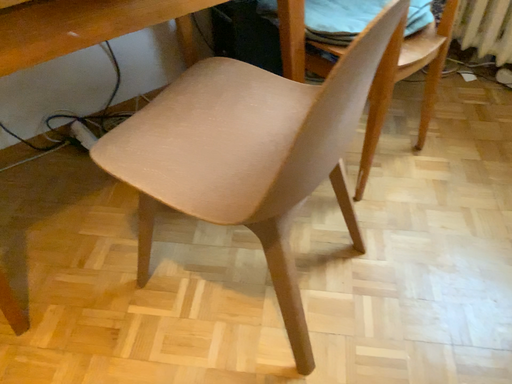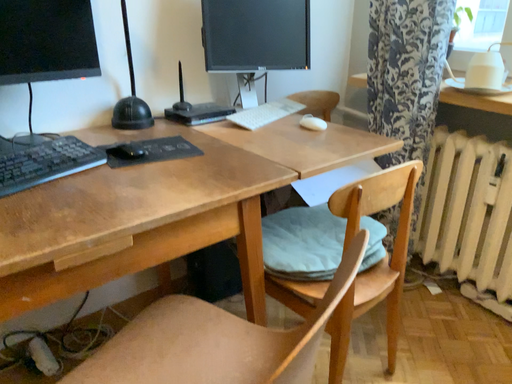
Question: How did the camera likely rotate when shooting the video?

Choices:
 (A) rotated upward
 (B) rotated downward

Answer: (A)